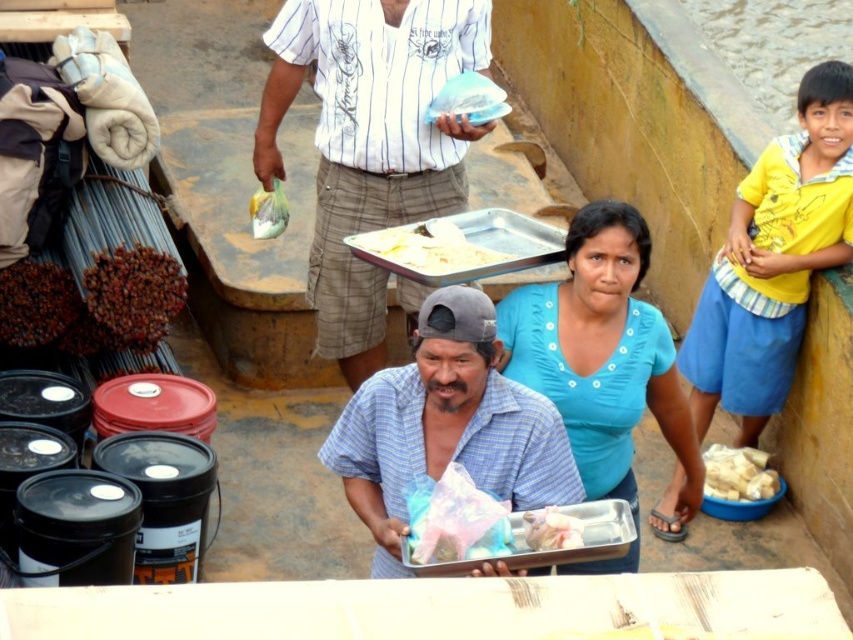
Question: Is white striped shirt at center to the right of white plastic bag at lower right from the viewer's perspective?

Choices:
 (A) yes
 (B) no

Answer: (B)

Question: Observing the image, what is the correct spatial positioning of blue plaid shirt at center in reference to white matte tray at center?

Choices:
 (A) above
 (B) below

Answer: (B)

Question: Which point is farther from the camera taking this photo?

Choices:
 (A) (518, 500)
 (B) (405, 234)

Answer: (B)

Question: Which is farther from the white plastic bag at lower right?

Choices:
 (A) white plastic bag at upper center
 (B) white matte tray at center

Answer: (A)

Question: Which object is closer to the camera taking this photo?

Choices:
 (A) blue plaid shirt at center
 (B) white plastic bag at lower right

Answer: (A)

Question: Is blue cotton shirt at center below white matte tray at center?

Choices:
 (A) no
 (B) yes

Answer: (B)